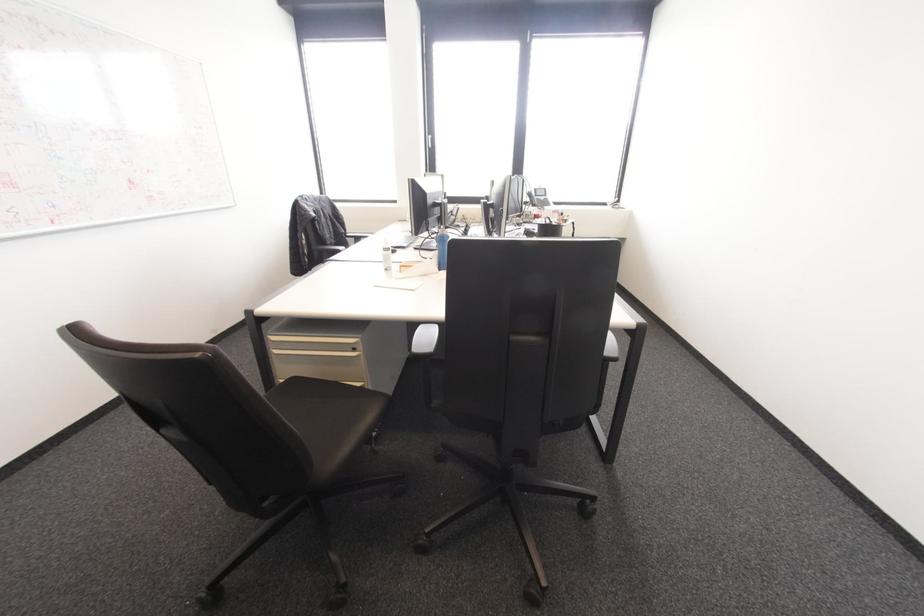
The height and width of the screenshot is (616, 924). I want to click on white spray bottle, so click(442, 248).